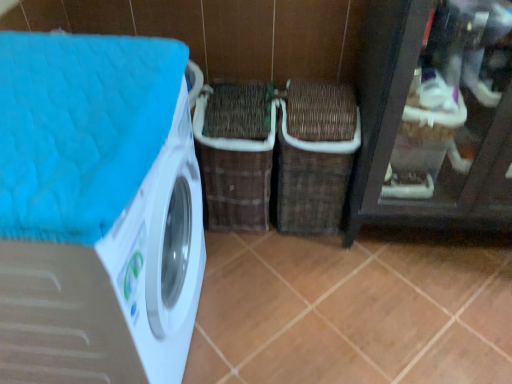
Find the location of `free location in front of brown woven basket at center, placed as the first basket when sorted from left to right`. free location in front of brown woven basket at center, placed as the first basket when sorted from left to right is located at coordinates (254, 261).